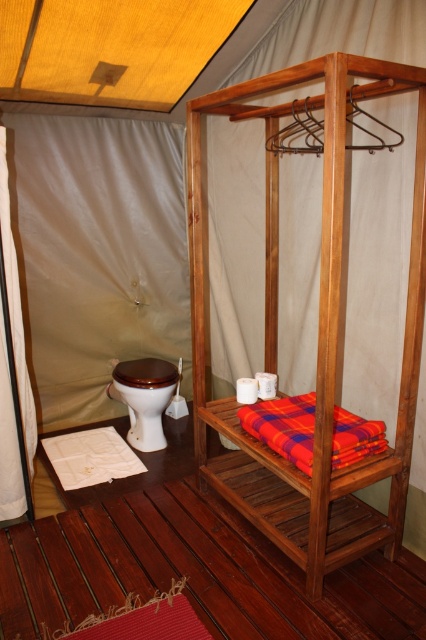
You are setting up a temporary bathroom and need to place a new shower curtain. The existing white fabric curtain at left is currently blocking access to the brown glossy toilet bowl at lower left. Which object should you move first to gain access to the toilet bowl?

You should move the white fabric curtain at left first because it is positioned to the left of the brown glossy toilet bowl at lower left, blocking access to it.

Consider the image. You are a traveler who just arrived at the safari tent bathroom. You need to place a new decorative pillow that is 25 cm wide on either the plaid fabric blanket at center or the brown glossy toilet bowl at lower left. Based on their widths, which object can the pillow fit on?

The plaid fabric blanket at center might be wider than brown glossy toilet bowl at lower left, so the pillow can fit on the plaid fabric blanket at center.